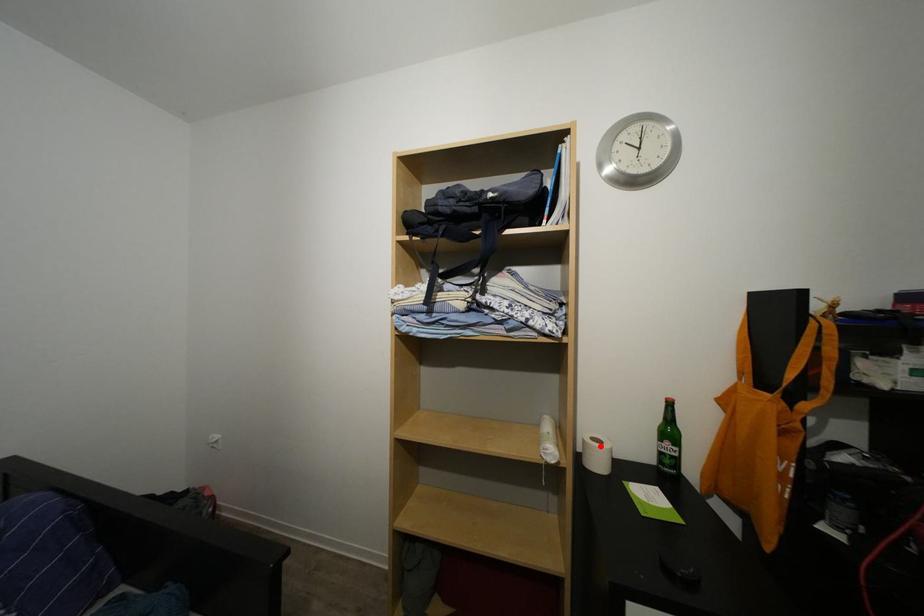
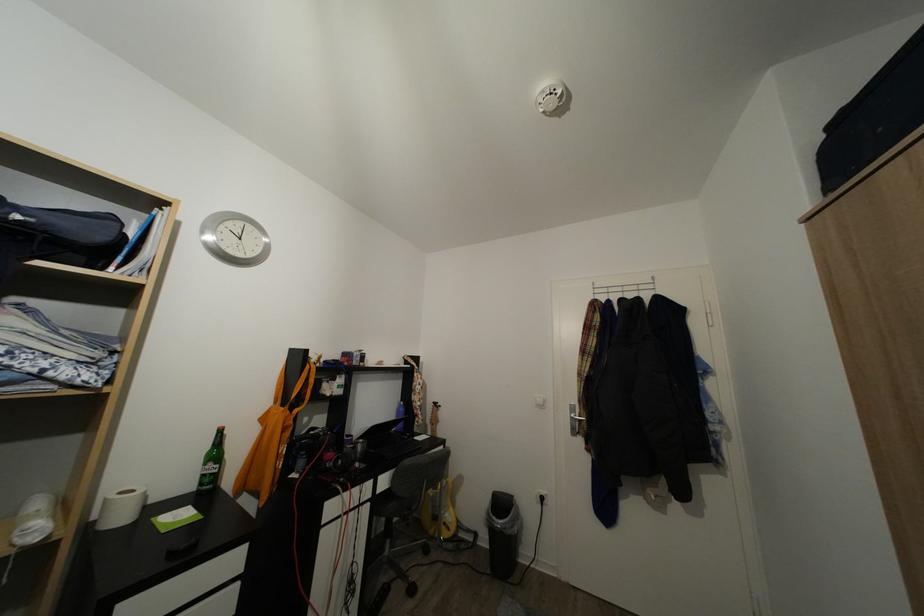
Question: I am providing you with two images of the same scene from different viewpoints. Given a red point in image1, look at the same physical point in image2. Is it:

Choices:
 (A) Closer to the viewpoint
 (B) Farther from the viewpoint

Answer: (A)